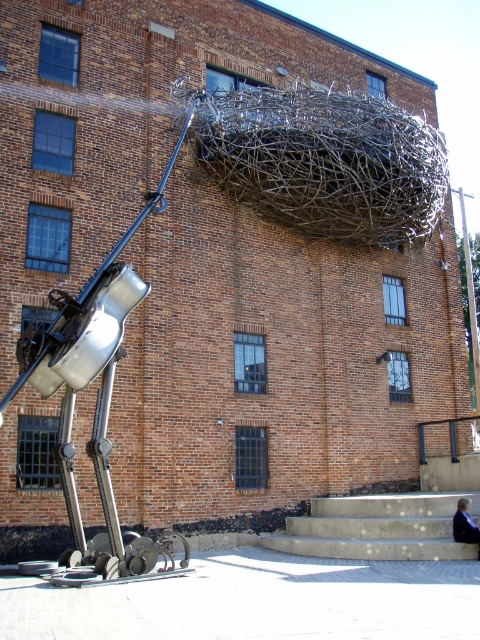
You are a delivery person standing at the base of the concrete stairs at lower right and need to place a dark blue fabric jacket at lower right nearby. Can you fit the jacket next to the stairs without overlapping them?

The concrete stairs at lower right are wider than the dark blue fabric jacket at lower right, so there is enough space to place the jacket next to the stairs without overlapping them.

You are standing at the bottom of the concrete stairs at lower right and want to place the dark blue fabric jacket at lower right on a shelf that is at the same height as the top of the stairs. Can the jacket reach the shelf?

The concrete stairs at lower right is taller than dark blue fabric jacket at lower right, so the jacket cannot reach the shelf at the top of the stairs.

You are a delivery person with a cart that is 2 meters wide. You need to move from the concrete stairs at lower right to the dark blue fabric jacket at lower right. Is there enough space between them for your cart to pass through?

The distance between the concrete stairs at lower right and the dark blue fabric jacket at lower right is 4.19 meters. Since your cart is 2 meters wide, there is sufficient space for it to pass through as the distance is greater than the cart width.